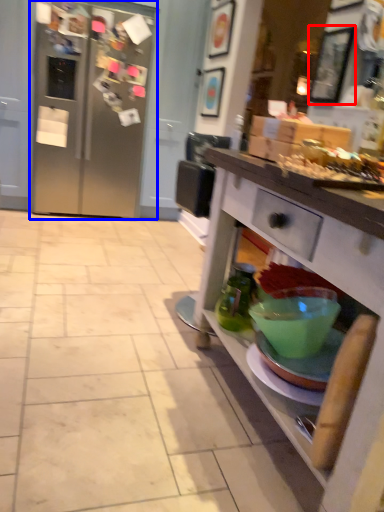
Question: Which of the following is the closest to the observer, picture frame (highlighted by a red box) or refrigerator (highlighted by a blue box)?

Choices:
 (A) picture frame
 (B) refrigerator

Answer: (A)